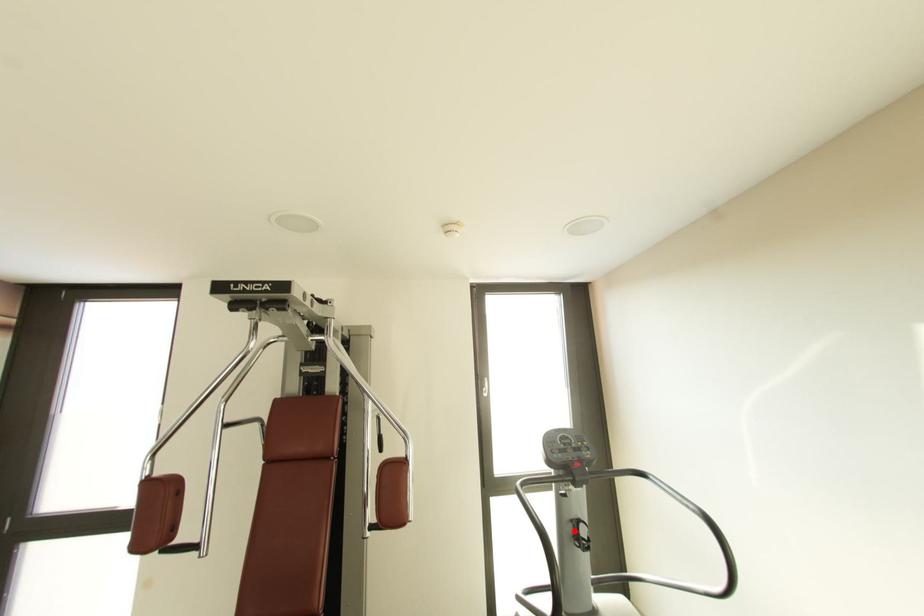
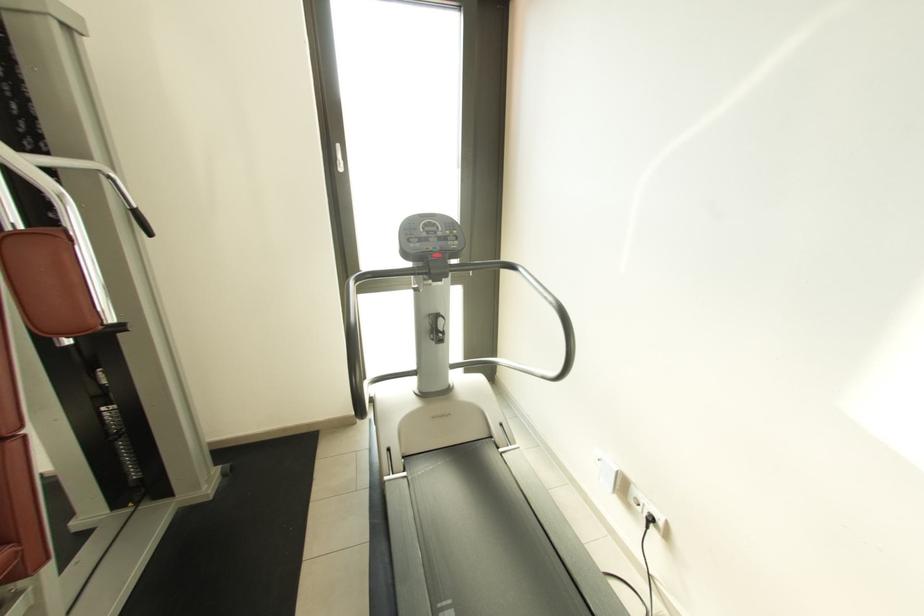
Locate, in the second image, the point that corresponds to the highlighted location in the first image.

(432, 325)